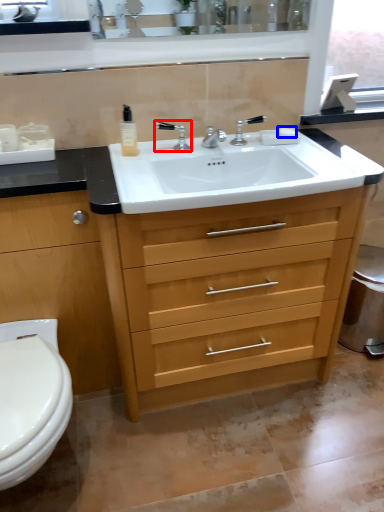
Question: Which of the following is the closest to the observer, tap (highlighted by a red box) or soap (highlighted by a blue box)?

Choices:
 (A) tap
 (B) soap

Answer: (A)